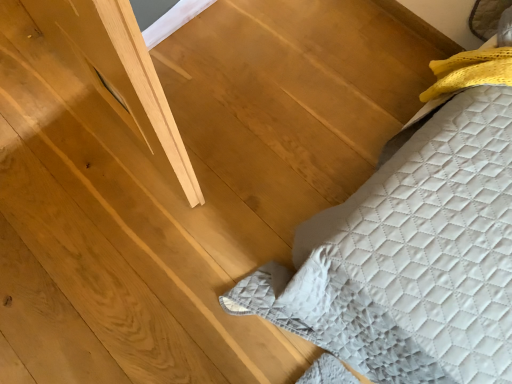
Question: Should I look upward or downward to see quilted fabric bed at lower right?

Choices:
 (A) down
 (B) up

Answer: (B)

Question: Is quilted fabric bed at lower right to the left of matte gray window at upper left from the viewer's perspective?

Choices:
 (A) yes
 (B) no

Answer: (B)

Question: Does quilted fabric bed at lower right have a smaller size compared to matte gray window at upper left?

Choices:
 (A) yes
 (B) no

Answer: (B)

Question: Does quilted fabric bed at lower right turn towards matte gray window at upper left?

Choices:
 (A) yes
 (B) no

Answer: (B)

Question: Considering the relative sizes of quilted fabric bed at lower right and matte gray window at upper left in the image provided, is quilted fabric bed at lower right taller than matte gray window at upper left?

Choices:
 (A) no
 (B) yes

Answer: (A)

Question: From a real-world perspective, is quilted fabric bed at lower right located beneath matte gray window at upper left?

Choices:
 (A) yes
 (B) no

Answer: (A)

Question: From the image's perspective, is quilted fabric bed at lower right on top of matte gray window at upper left?

Choices:
 (A) no
 (B) yes

Answer: (A)

Question: From the image's perspective, is matte gray window at upper left located beneath quilted fabric bed at lower right?

Choices:
 (A) no
 (B) yes

Answer: (A)

Question: From a real-world perspective, is matte gray window at upper left on quilted fabric bed at lower right?

Choices:
 (A) yes
 (B) no

Answer: (A)

Question: Can you confirm if matte gray window at upper left is bigger than quilted fabric bed at lower right?

Choices:
 (A) no
 (B) yes

Answer: (A)

Question: Is matte gray window at upper left shorter than quilted fabric bed at lower right?

Choices:
 (A) no
 (B) yes

Answer: (A)

Question: Considering the relative sizes of matte gray window at upper left and quilted fabric bed at lower right in the image provided, is matte gray window at upper left taller than quilted fabric bed at lower right?

Choices:
 (A) yes
 (B) no

Answer: (A)

Question: Does matte gray window at upper left contain quilted fabric bed at lower right?

Choices:
 (A) no
 (B) yes

Answer: (A)

Question: In terms of size, does quilted fabric bed at lower right appear bigger or smaller than matte gray window at upper left?

Choices:
 (A) small
 (B) big

Answer: (B)